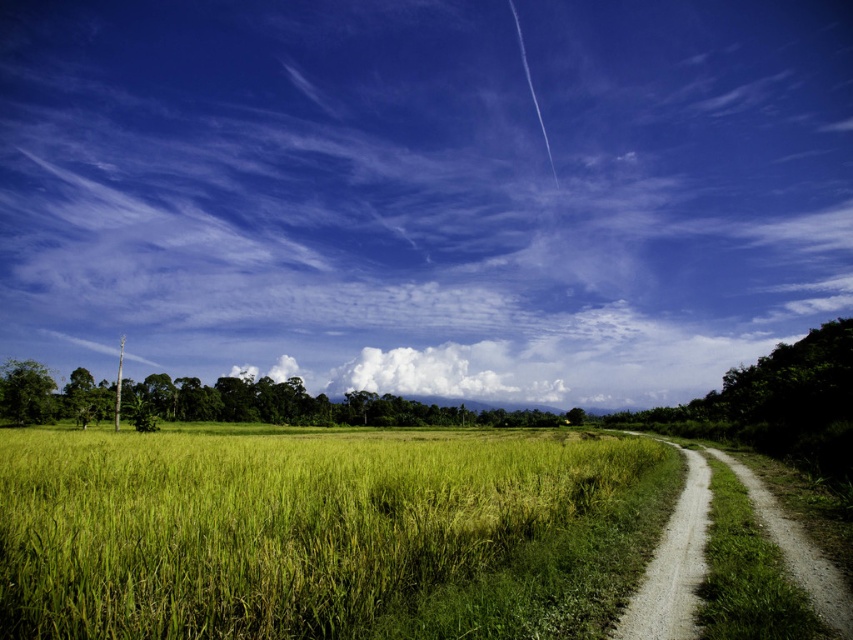
Question: Considering the real-world distances, which object is closest to the gravel path at right?

Choices:
 (A) green grassy rice field at center
 (B) dirt/gravel path at right

Answer: (B)

Question: Which of these objects is positioned farthest from the gravel path at right?

Choices:
 (A) dirt/gravel path at right
 (B) green grassy rice field at center

Answer: (B)

Question: Is green grassy rice field at center smaller than gravel path at right?

Choices:
 (A) no
 (B) yes

Answer: (A)

Question: Can you confirm if green grassy rice field at center is thinner than gravel path at right?

Choices:
 (A) no
 (B) yes

Answer: (A)

Question: Where is dirt/gravel path at right located in relation to gravel path at right in the image?

Choices:
 (A) above
 (B) below

Answer: (A)

Question: Among these objects, which one is farthest from the camera?

Choices:
 (A) green grassy rice field at center
 (B) dirt/gravel path at right
 (C) gravel path at right

Answer: (C)